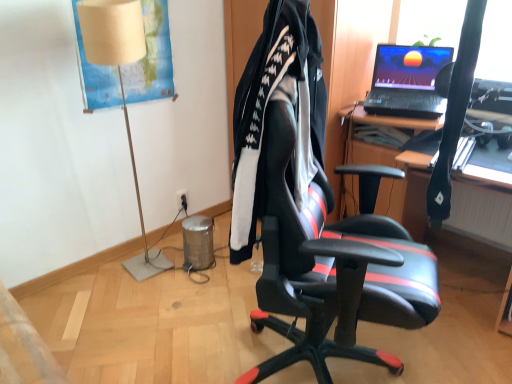
Question: From a real-world perspective, does black fabric jacket at center stand above black leather chair at center?

Choices:
 (A) yes
 (B) no

Answer: (A)

Question: Can you confirm if black fabric jacket at center is smaller than black leather chair at center?

Choices:
 (A) yes
 (B) no

Answer: (A)

Question: Is black fabric jacket at center bigger than black leather chair at center?

Choices:
 (A) no
 (B) yes

Answer: (A)

Question: Is black fabric jacket at center next to black leather chair at center and touching it?

Choices:
 (A) no
 (B) yes

Answer: (A)

Question: Is black leather chair at center inside black fabric jacket at center?

Choices:
 (A) no
 (B) yes

Answer: (A)

Question: Visually, is black plastic power outlet at lower center positioned to the left or to the right of beige fabric lampshade at left?

Choices:
 (A) right
 (B) left

Answer: (A)

Question: Looking at their shapes, would you say black plastic power outlet at lower center is wider or thinner than beige fabric lampshade at left?

Choices:
 (A) thin
 (B) wide

Answer: (A)

Question: From the image's perspective, is black plastic power outlet at lower center positioned above or below beige fabric lampshade at left?

Choices:
 (A) above
 (B) below

Answer: (B)

Question: In terms of height, does black plastic power outlet at lower center look taller or shorter compared to beige fabric lampshade at left?

Choices:
 (A) tall
 (B) short

Answer: (B)

Question: Looking at their shapes, would you say beige fabric lampshade at left is wider or thinner than black fabric jacket at center?

Choices:
 (A) thin
 (B) wide

Answer: (B)

Question: Is beige fabric lampshade at left to the left or to the right of black fabric jacket at center in the image?

Choices:
 (A) right
 (B) left

Answer: (B)

Question: Is point pos(88,29) closer or farther from the camera than point pos(265,34)?

Choices:
 (A) farther
 (B) closer

Answer: (A)

Question: From the image's perspective, is beige fabric lampshade at left located above or below black fabric jacket at center?

Choices:
 (A) below
 (B) above

Answer: (B)

Question: Is black plastic power outlet at lower center wider or thinner than black leather chair at center?

Choices:
 (A) thin
 (B) wide

Answer: (A)

Question: Considering their positions, is black plastic power outlet at lower center located in front of or behind black leather chair at center?

Choices:
 (A) behind
 (B) front

Answer: (A)